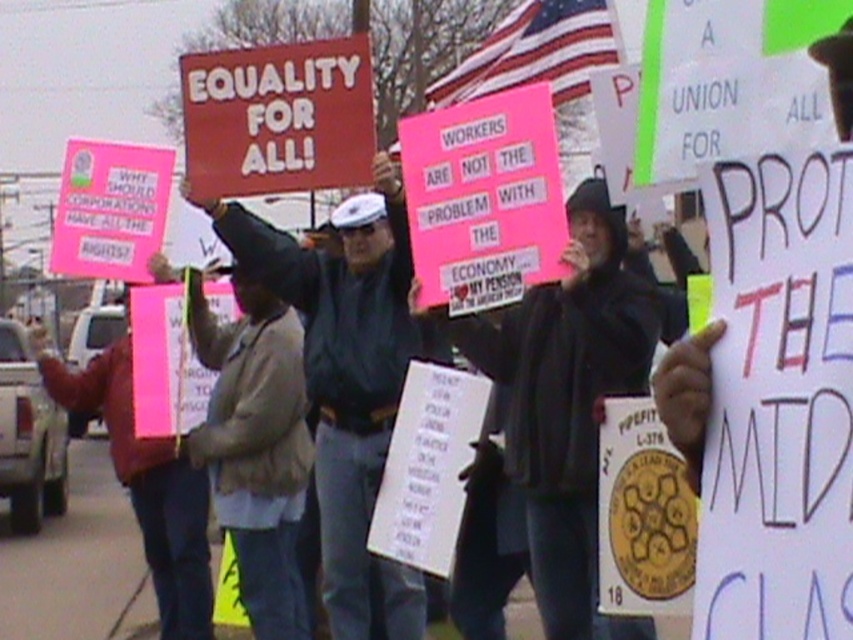
Question: Which object is farther from the camera taking this photo?

Choices:
 (A) tan suede jacket at center
 (B) dark gray uniform at center

Answer: (A)

Question: Is tan suede jacket at center smaller than red matte sign at center?

Choices:
 (A) no
 (B) yes

Answer: (A)

Question: Which object is the closest to the tan suede jacket at center?

Choices:
 (A) red matte sign at center
 (B) dark gray uniform at center

Answer: (B)

Question: Does dark gray uniform at center appear on the right side of red matte sign at center?

Choices:
 (A) yes
 (B) no

Answer: (A)

Question: Estimate the real-world distances between objects in this image. Which object is farther from the tan suede jacket at center?

Choices:
 (A) red matte sign at center
 (B) dark gray uniform at center

Answer: (A)

Question: Does dark gray uniform at center have a smaller size compared to red matte sign at center?

Choices:
 (A) yes
 (B) no

Answer: (B)